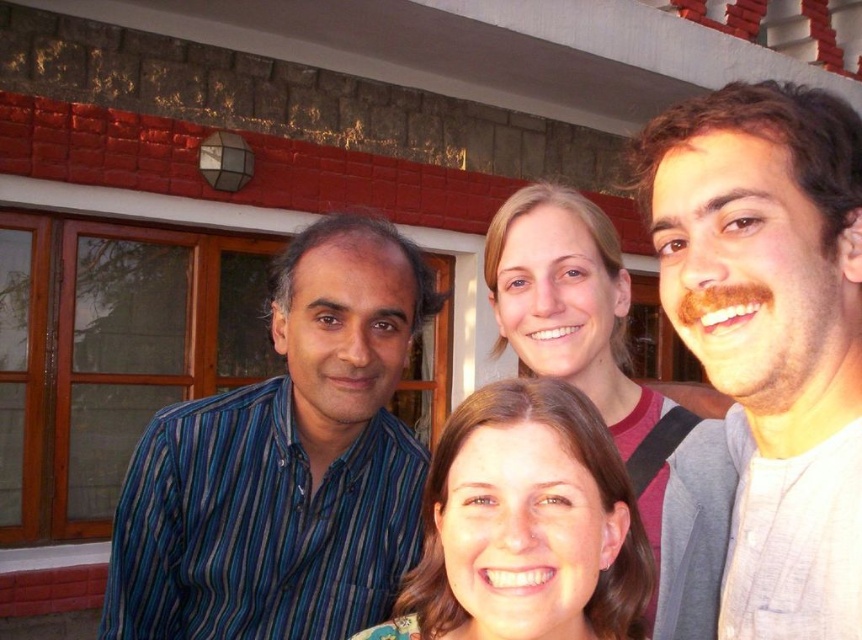
Does point (259, 460) lie in front of point (558, 561)?

No, it is not.

Locate an element on the screen. blue striped shirt at left is located at coordinates (285, 464).

Is point (395, 356) farther from camera compared to point (532, 636)?

That is True.

I want to click on blue striped shirt at left, so click(285, 464).

Who is positioned more to the right, blue striped shirt at left or smooth blonde hair at center?

Positioned to the right is smooth blonde hair at center.

Which is in front, point (328, 400) or point (661, 429)?

Point (328, 400) is in front.

Is point (186, 557) positioned before point (689, 624)?

No, (186, 557) is behind (689, 624).

This screenshot has height=640, width=862. I want to click on blue striped shirt at left, so click(x=285, y=464).

Can you confirm if gray cotton shirt at right is taller than smooth blonde hair at center?

In fact, gray cotton shirt at right may be shorter than smooth blonde hair at center.

Where is `gray cotton shirt at right`? gray cotton shirt at right is located at coordinates (772, 332).